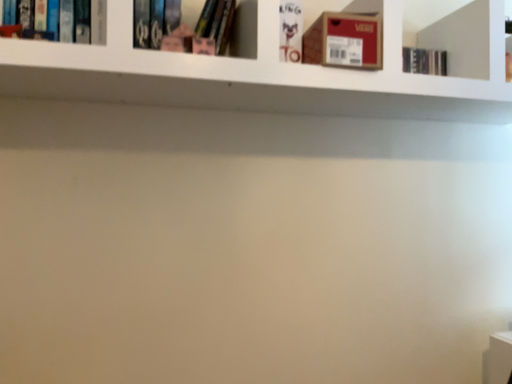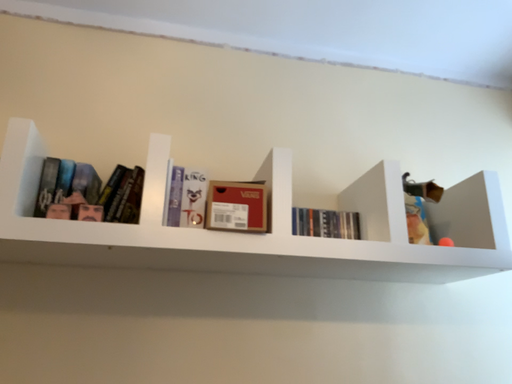
Question: Which way did the camera rotate in the video?

Choices:
 (A) rotated upward
 (B) rotated downward

Answer: (A)